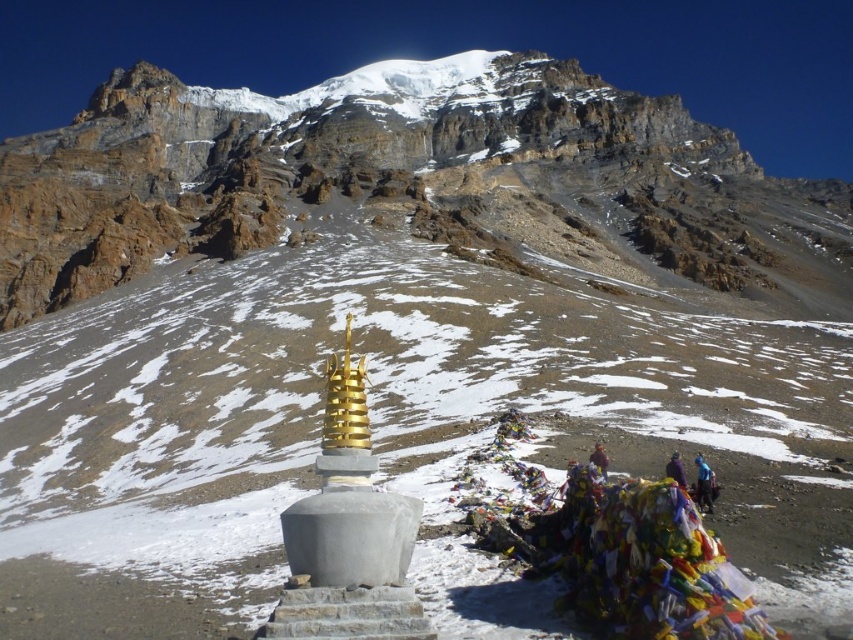
Question: Observing the image, what is the correct spatial positioning of white rocky mountain at center in reference to purple fabric at lower right?

Choices:
 (A) above
 (B) below

Answer: (A)

Question: Which object is positioned farthest from the purple fabric at lower right?

Choices:
 (A) blue fabric at lower right
 (B) white rocky mountain at center

Answer: (B)

Question: Which point is farther to the camera?

Choices:
 (A) (683, 486)
 (B) (697, 456)

Answer: (B)

Question: Among these objects, which one is nearest to the camera?

Choices:
 (A) white rocky mountain at center
 (B) brown leather jacket at lower right
 (C) blue fabric at lower right

Answer: (B)

Question: Is white rocky mountain at center positioned in front of blue fabric at lower right?

Choices:
 (A) no
 (B) yes

Answer: (A)

Question: Can you confirm if white rocky mountain at center is positioned to the left of purple fabric at lower right?

Choices:
 (A) yes
 (B) no

Answer: (A)